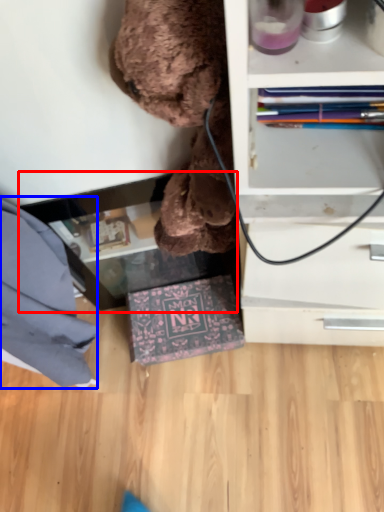
Question: Which point is closer to the camera, table (highlighted by a red box) or clothe (highlighted by a blue box)?

Choices:
 (A) table
 (B) clothe

Answer: (B)